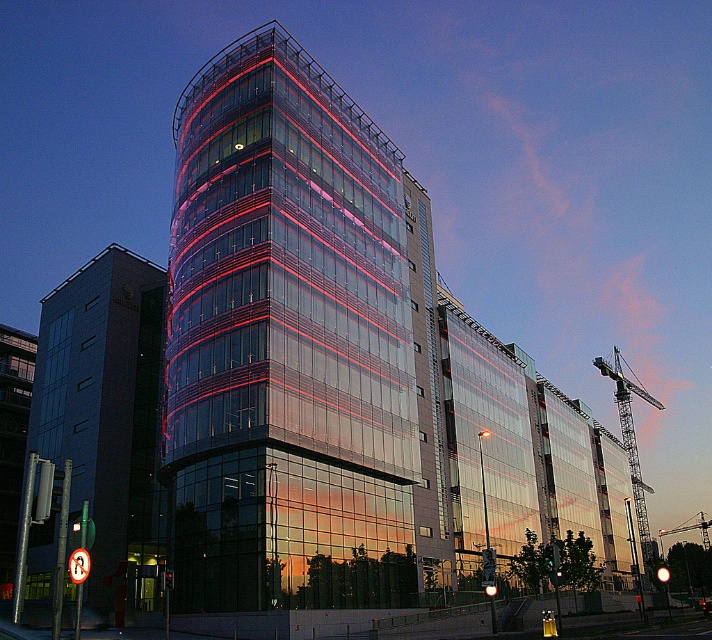
I want to click on dark glass building at left, so click(x=105, y=416).

Does dark glass building at left have a larger size compared to metallic gray crane at right?

Incorrect, dark glass building at left is not larger than metallic gray crane at right.

You are a GUI agent. You are given a task and a screenshot of the screen. Output one action in this format:
    pyautogui.click(x=<x>, y=<y>)
    Task: Click on the dark glass building at left
    This screenshot has width=712, height=640.
    Given the screenshot: What is the action you would take?
    pyautogui.click(x=105, y=416)

Locate an element on the screen. dark glass building at left is located at coordinates (105, 416).

Is point (95, 337) in front of point (706, 540)?

That is True.

Is dark glass building at left bigger than metallic construction crane at right?

Yes, dark glass building at left is bigger than metallic construction crane at right.

Who is more forward, (51, 352) or (706, 524)?

Point (51, 352)

Image resolution: width=712 pixels, height=640 pixels. What are the coordinates of `dark glass building at left` in the screenshot? It's located at (105, 416).

Is metallic gray crane at right wider than metallic construction crane at right?

Yes.

Between metallic gray crane at right and metallic construction crane at right, which one is positioned lower?

metallic construction crane at right is below.

Where is `metallic gray crane at right`? The width and height of the screenshot is (712, 640). metallic gray crane at right is located at coordinates (629, 442).